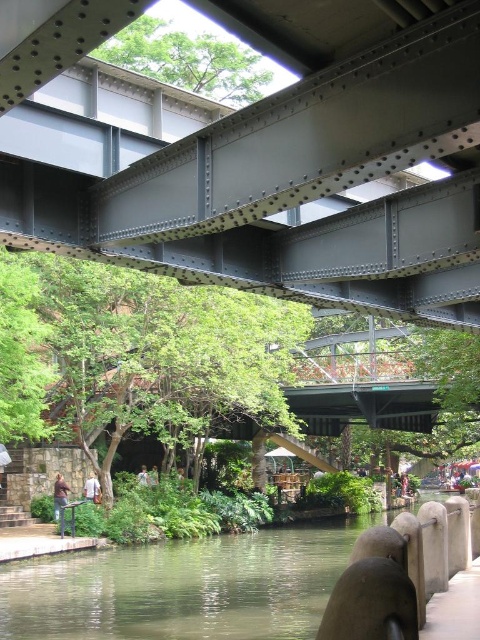
Question: Does green concrete river at lower center appear over brown leather jacket at lower left?

Choices:
 (A) no
 (B) yes

Answer: (A)

Question: Does gray metallic bridge at upper center have a lesser width compared to light brown hair at center?

Choices:
 (A) yes
 (B) no

Answer: (B)

Question: Observing the image, what is the correct spatial positioning of gray metallic bridge at upper center in reference to green concrete river at lower center?

Choices:
 (A) left
 (B) right

Answer: (A)

Question: Which point is farther to the camera?

Choices:
 (A) pos(81,627)
 (B) pos(84,496)

Answer: (B)

Question: Which of the following is the farthest from the observer?

Choices:
 (A) green concrete river at lower center
 (B) light brown hair at lower center
 (C) concrete at lower right

Answer: (B)

Question: Which of these objects is positioned farthest from the light brown hair at center?

Choices:
 (A) white cotton shirt at lower left
 (B) light brown hair at lower center
 (C) gray metallic bridge at upper center
 (D) concrete at lower right

Answer: (C)